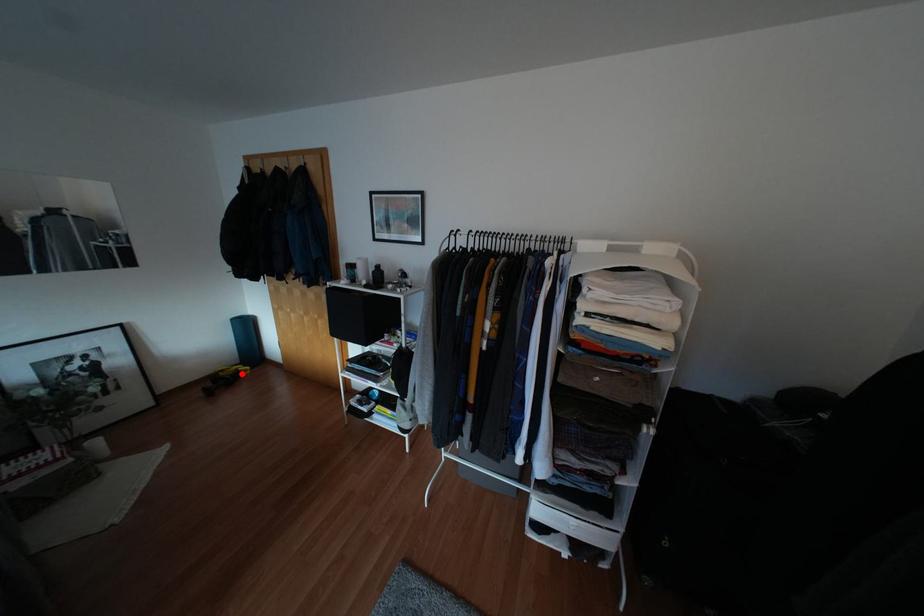
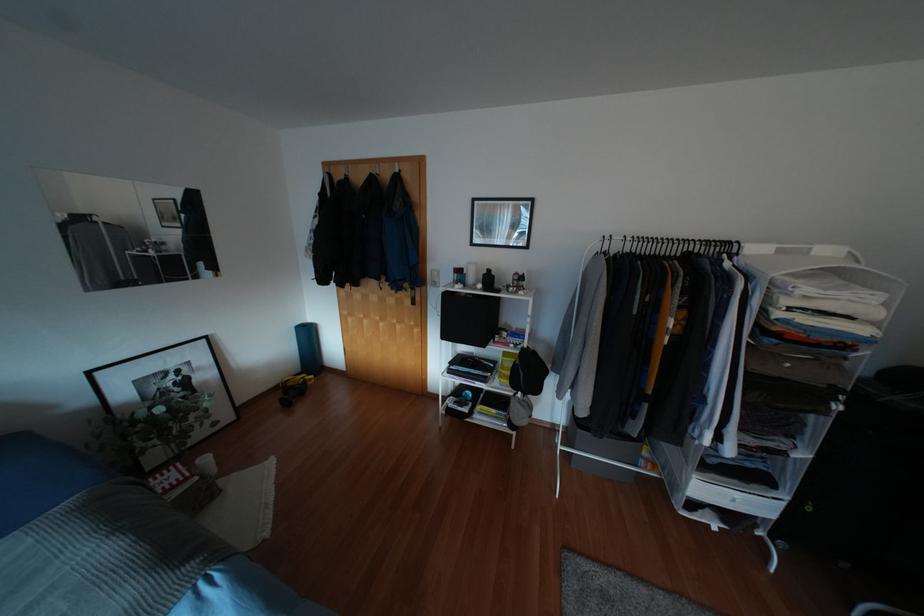
In the second image, find the point that corresponds to the highlighted location in the first image.

(309, 383)